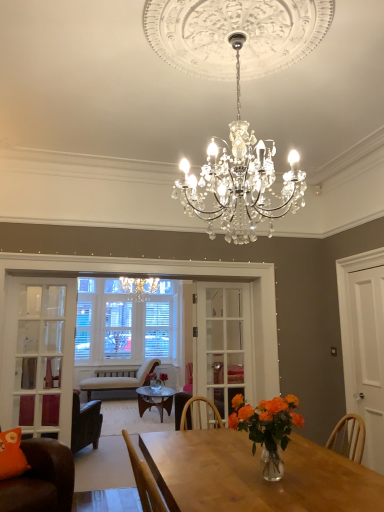
Question: Is orange matte vase at center to the left of orange fabric pillow at lower left from the viewer's perspective?

Choices:
 (A) yes
 (B) no

Answer: (B)

Question: Does orange matte vase at center have a greater width compared to orange fabric pillow at lower left?

Choices:
 (A) no
 (B) yes

Answer: (A)

Question: From a real-world perspective, is orange matte vase at center on top of orange fabric pillow at lower left?

Choices:
 (A) yes
 (B) no

Answer: (A)

Question: Considering the relative sizes of orange matte vase at center and orange fabric pillow at lower left in the image provided, is orange matte vase at center smaller than orange fabric pillow at lower left?

Choices:
 (A) no
 (B) yes

Answer: (A)

Question: Is orange matte vase at center further to the viewer compared to orange fabric pillow at lower left?

Choices:
 (A) no
 (B) yes

Answer: (A)

Question: Considering the positions of white matte door at right and orange fabric pillow at lower left in the image, is white matte door at right bigger or smaller than orange fabric pillow at lower left?

Choices:
 (A) big
 (B) small

Answer: (A)

Question: From the image's perspective, is white matte door at right above or below orange fabric pillow at lower left?

Choices:
 (A) above
 (B) below

Answer: (A)

Question: From a real-world perspective, relative to orange fabric pillow at lower left, is white matte door at right vertically above or below?

Choices:
 (A) above
 (B) below

Answer: (A)

Question: Considering their positions, is white matte door at right located in front of or behind orange fabric pillow at lower left?

Choices:
 (A) behind
 (B) front

Answer: (A)

Question: Is orange fabric pillow at lower left taller or shorter than brown leather chair at lower left, the first chair when ordered from top to bottom?

Choices:
 (A) tall
 (B) short

Answer: (B)

Question: Looking at the image, does orange fabric pillow at lower left seem bigger or smaller compared to brown leather chair at lower left, which is counted as the second chair, starting from the bottom?

Choices:
 (A) big
 (B) small

Answer: (B)

Question: Considering the positions of point (9, 430) and point (31, 478), is point (9, 430) closer or farther from the camera than point (31, 478)?

Choices:
 (A) closer
 (B) farther

Answer: (B)

Question: Is orange fabric pillow at lower left wider or thinner than brown leather chair at lower left, which is the first chair in front-to-back order?

Choices:
 (A) thin
 (B) wide

Answer: (A)

Question: In terms of width, does clear glass door at center, which is the 1th glass door in right-to-left order, look wider or thinner when compared to brown leather chair at lower left, which is the first chair in front-to-back order?

Choices:
 (A) wide
 (B) thin

Answer: (B)

Question: Relative to brown leather chair at lower left, the first chair when ordered from top to bottom, is clear glass door at center, which is the 1th glass door in right-to-left order, in front or behind?

Choices:
 (A) behind
 (B) front

Answer: (A)